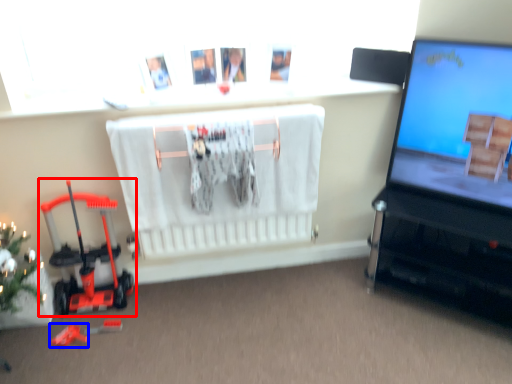
Question: Which object appears farthest to the camera in this image, toy (highlighted by a red box) or toy (highlighted by a blue box)?

Choices:
 (A) toy
 (B) toy

Answer: (B)